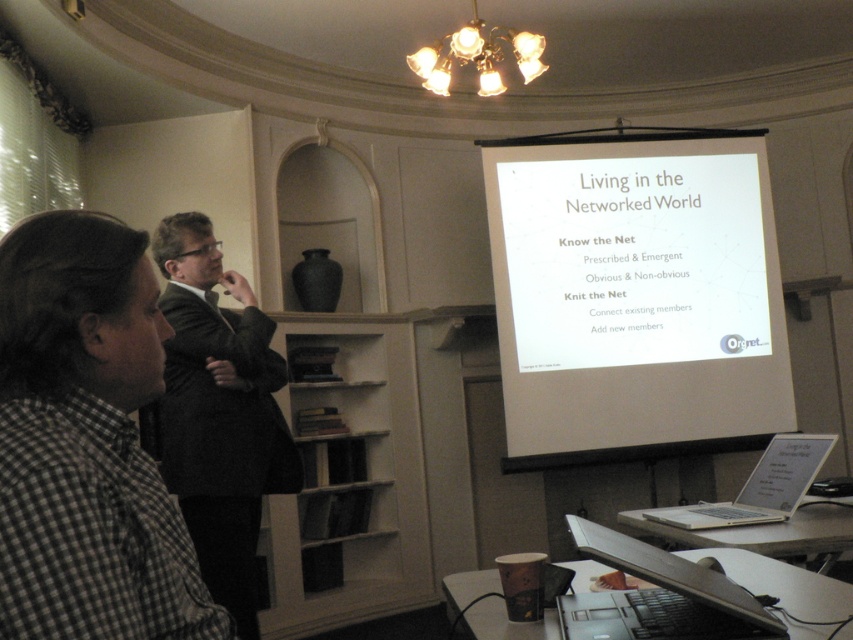
You are organizing a presentation and need to place a name tag on the table. The name tag is 10 cm wide. Can the dark gray suit at left and the silver metallic laptop at lower right both fit on the table with the name tag without overlapping?

The dark gray suit at left is thinner than the silver metallic laptop at lower right, but there is no information provided about the table size or the space between them. Therefore, it is uncertain if they can fit with the name tag without overlapping.